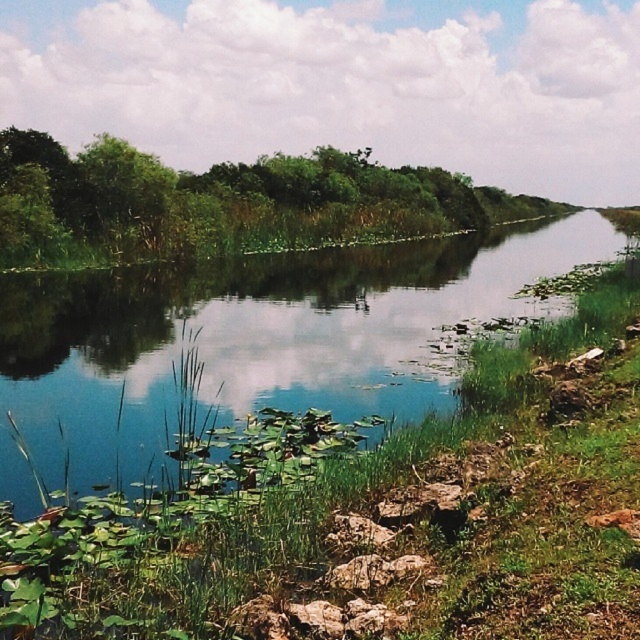
Question: Can you confirm if green leafy trees at left is positioned to the right of green leafy tree at upper left?

Choices:
 (A) no
 (B) yes

Answer: (B)

Question: From the image, what is the correct spatial relationship of green leafy trees at left in relation to green leafy tree at upper left?

Choices:
 (A) below
 (B) above

Answer: (B)

Question: Which is nearer to the green grassy river at center?

Choices:
 (A) green leafy tree at upper left
 (B) green leafy trees at left

Answer: (A)

Question: Which point appears farthest from the camera in this image?

Choices:
 (A) (161, 209)
 (B) (513, 310)
 (C) (355, 164)

Answer: (C)

Question: Which of the following is the closest to the observer?

Choices:
 (A) [272, 344]
 (B) [140, 198]

Answer: (A)

Question: Is green grassy river at center positioned before green leafy trees at left?

Choices:
 (A) no
 (B) yes

Answer: (B)